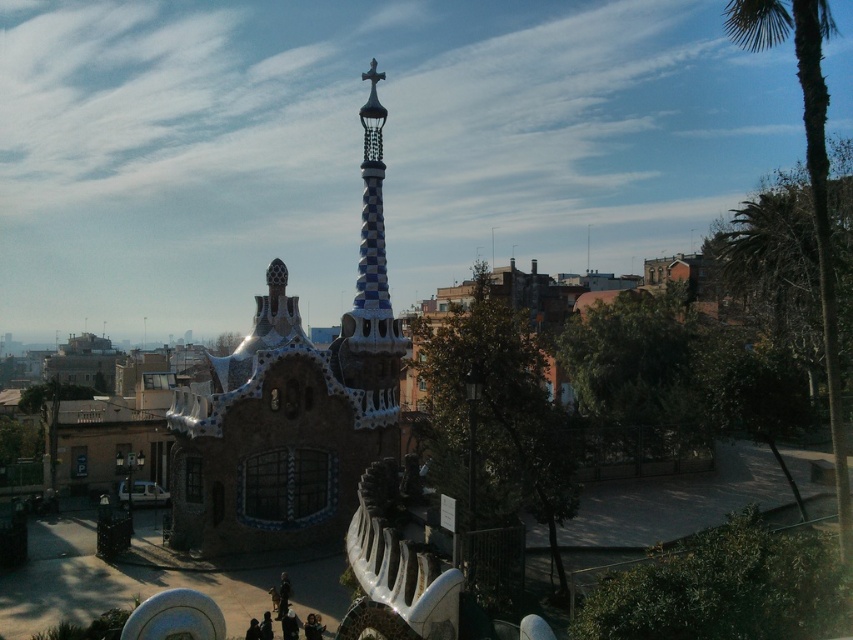
You are standing at the entrance of the structure and want to locate the blue mosaic tower at center. According to the coordinates provided, where should you look relative to your current position?

The blue mosaic tower at center is located at coordinates point (283, 426), which means it is positioned to the right and slightly above your current position at the entrance.

You are standing in front of the architectural structure and want to take a photo that includes both the spire and the cross. You notice two points marked on the structure. Which of the two points, point (194,483) or point (364,333), is closer to you?

Point (194,483) is closer to the camera than point (364,333), so it is closer to you.